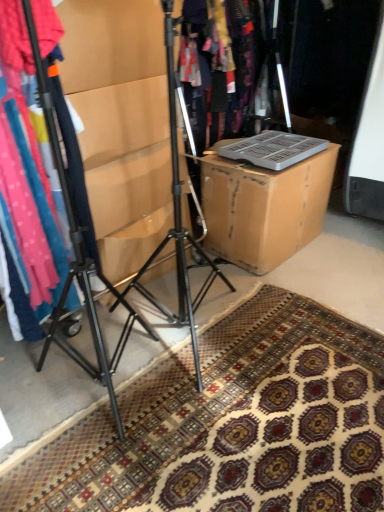
Question: From the image's perspective, does brown cardboard box at center appear higher than matte cardboard box at center?

Choices:
 (A) no
 (B) yes

Answer: (B)

Question: Does brown cardboard box at center have a lesser height compared to matte cardboard box at center?

Choices:
 (A) yes
 (B) no

Answer: (A)

Question: Could you tell me if brown cardboard box at center is facing matte cardboard box at center?

Choices:
 (A) yes
 (B) no

Answer: (B)

Question: Can you confirm if brown cardboard box at center is bigger than matte cardboard box at center?

Choices:
 (A) yes
 (B) no

Answer: (B)

Question: Is brown cardboard box at center not close to matte cardboard box at center?

Choices:
 (A) yes
 (B) no

Answer: (B)

Question: Can you confirm if brown cardboard box at center is positioned to the right of matte cardboard box at center?

Choices:
 (A) no
 (B) yes

Answer: (B)

Question: Is matte plastic laptop at center thinner than patterned carpet at lower center?

Choices:
 (A) yes
 (B) no

Answer: (A)

Question: Is matte plastic laptop at center shorter than patterned carpet at lower center?

Choices:
 (A) yes
 (B) no

Answer: (B)

Question: From the image's perspective, does matte plastic laptop at center appear lower than patterned carpet at lower center?

Choices:
 (A) no
 (B) yes

Answer: (A)

Question: Is matte plastic laptop at center at the right side of patterned carpet at lower center?

Choices:
 (A) yes
 (B) no

Answer: (B)

Question: Is matte plastic laptop at center next to patterned carpet at lower center and touching it?

Choices:
 (A) no
 (B) yes

Answer: (A)

Question: Considering the relative sizes of matte plastic laptop at center and patterned carpet at lower center in the image provided, is matte plastic laptop at center smaller than patterned carpet at lower center?

Choices:
 (A) no
 (B) yes

Answer: (A)

Question: Would you say brown cardboard box at center is outside black metal tripod at center?

Choices:
 (A) no
 (B) yes

Answer: (B)